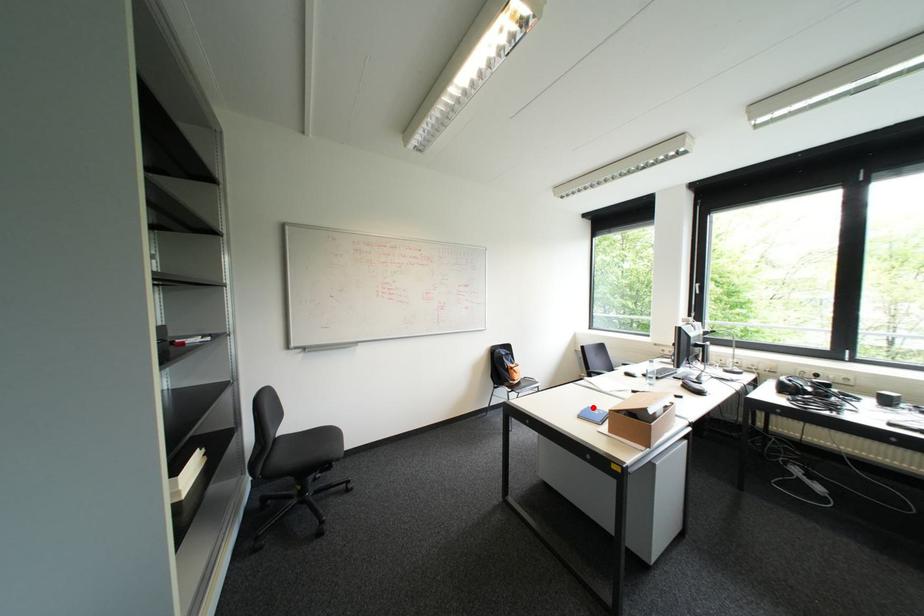
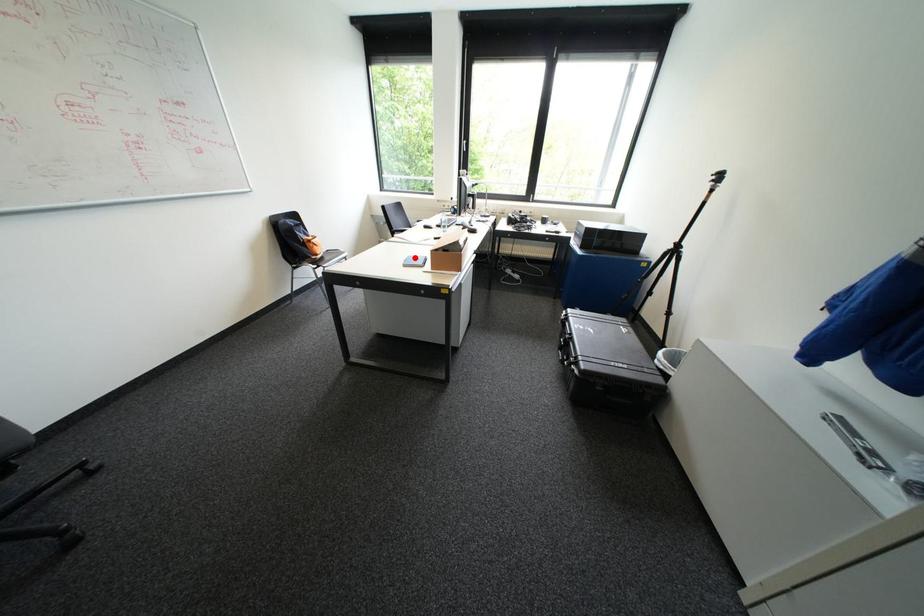
I am providing you with two images of the same scene from different viewpoints. A red point is marked on the first image and another point is marked on the second image. Is the marked point in image1 the same physical position as the marked point in image2?

Yes